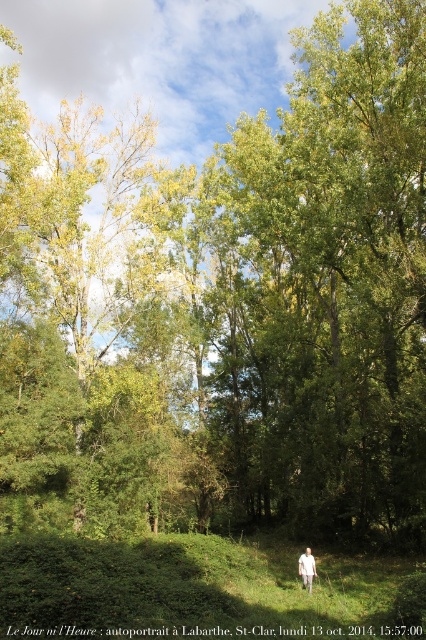
You are a photographer trying to capture the autumn scenery. You notice the green grassy at center and the white cotton shirt at lower center in your frame. Which object takes up more space in the photo?

The green grassy at center takes up more space in the photo because it is larger in size than the white cotton shirt at lower center.

You are standing on the path in the scene. Which object is closer to you, the green grassy at center or the white cotton shirt at lower center?

The green grassy at center is closer to you because it is in front of the white cotton shirt at lower center.